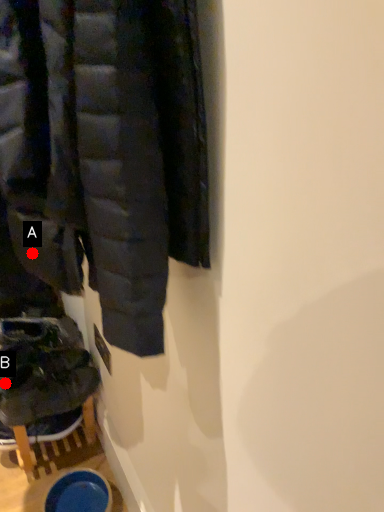
Question: Two points are circled on the image, labeled by A and B beside each circle. Which of the following is the closest to the observer?

Choices:
 (A) A is closer
 (B) B is closer

Answer: (A)